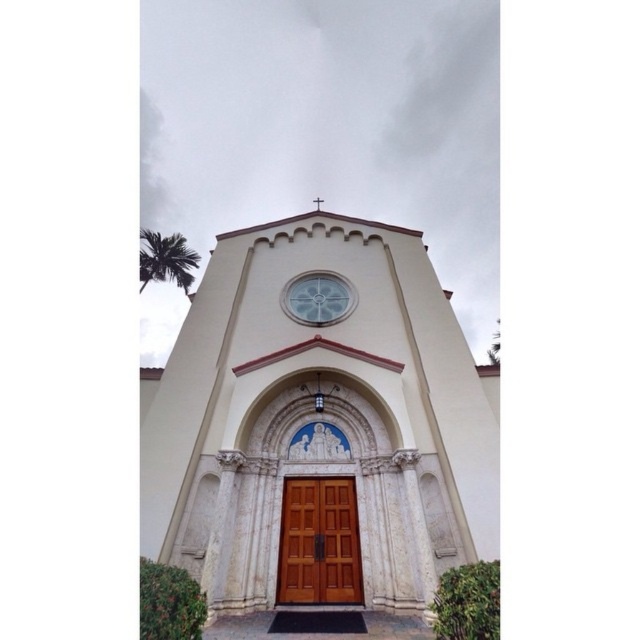
Looking at this image, you are a painter who needs to decide which object to paint first. The wooden door at center and the clear glass clock at center are both in need of touchups. Considering their sizes, which one should you tackle first if you want to start with the larger object?

The wooden door at center is thinner than the clear glass clock at center, so the clear glass clock at center is larger. Therefore, you should start with the clear glass clock at center first.

You are standing in front of the smooth beige stone church at center and want to enter through the wooden door at center. Can you walk directly to the door without going around the building?

The smooth beige stone church at center is in front of the wooden door at center, so you cannot walk directly to the wooden door at center. You will have to go around the building or find another entrance.